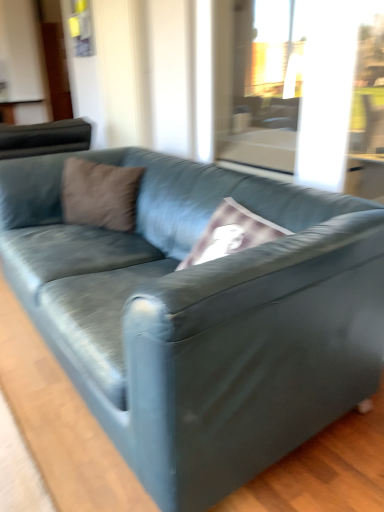
Question: From the image's perspective, does brown suede pillow at upper left appear higher than suede blue couch at center?

Choices:
 (A) no
 (B) yes

Answer: (B)

Question: Can you confirm if brown suede pillow at upper left is wider than suede blue couch at center?

Choices:
 (A) yes
 (B) no

Answer: (B)

Question: Is suede blue couch at center completely or partially inside brown suede pillow at upper left?

Choices:
 (A) yes
 (B) no

Answer: (B)

Question: Does brown suede pillow at upper left appear on the left side of suede blue couch at center?

Choices:
 (A) no
 (B) yes

Answer: (B)

Question: Is the position of brown suede pillow at upper left less distant than that of suede blue couch at center?

Choices:
 (A) yes
 (B) no

Answer: (B)

Question: Is brown suede pillow at upper left to the right of suede blue couch at center from the viewer's perspective?

Choices:
 (A) yes
 (B) no

Answer: (B)

Question: Is suede blue couch at center thinner than brown suede pillow at upper left?

Choices:
 (A) no
 (B) yes

Answer: (A)

Question: Considering the relative sizes of suede blue couch at center and brown suede pillow at upper left in the image provided, is suede blue couch at center shorter than brown suede pillow at upper left?

Choices:
 (A) no
 (B) yes

Answer: (A)

Question: Is brown suede pillow at upper left at the back of suede blue couch at center?

Choices:
 (A) no
 (B) yes

Answer: (B)

Question: From the image's perspective, would you say suede blue couch at center is positioned over brown suede pillow at upper left?

Choices:
 (A) yes
 (B) no

Answer: (B)

Question: Is suede blue couch at center not inside brown suede pillow at upper left?

Choices:
 (A) yes
 (B) no

Answer: (A)

Question: Could you tell me if suede blue couch at center is facing brown suede pillow at upper left?

Choices:
 (A) no
 (B) yes

Answer: (B)

Question: Visually, is suede blue couch at center positioned to the left or to the right of brown suede pillow at upper left?

Choices:
 (A) right
 (B) left

Answer: (A)